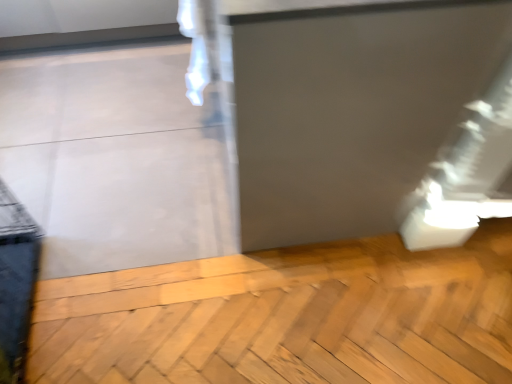
What do you see at coordinates (352, 110) in the screenshot? This screenshot has height=384, width=512. I see `matte gray screen door at center` at bounding box center [352, 110].

Where is `matte gray screen door at center`? matte gray screen door at center is located at coordinates (352, 110).

The height and width of the screenshot is (384, 512). I want to click on matte gray screen door at center, so click(352, 110).